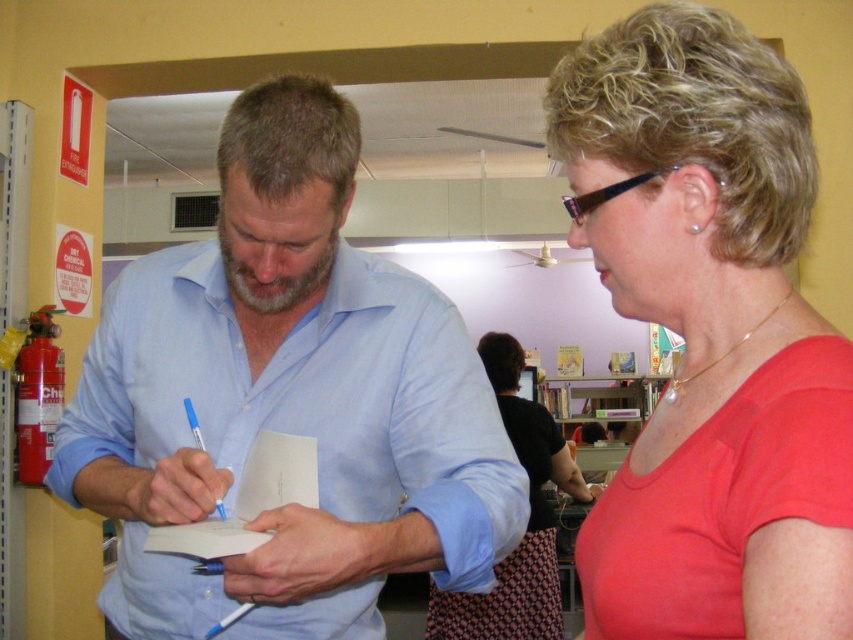
Question: Can you confirm if matte black shirt at center is thinner than wooden bookshelf at center?

Choices:
 (A) yes
 (B) no

Answer: (A)

Question: Considering the real-world distances, which object is farthest from the matte red shirt at center?

Choices:
 (A) matte black shirt at center
 (B) wooden bookshelf at center
 (C) blue shirt at center

Answer: (B)

Question: Can you confirm if matte red shirt at center is thinner than wooden bookshelf at center?

Choices:
 (A) no
 (B) yes

Answer: (B)

Question: Which is farther from the matte red shirt at center?

Choices:
 (A) blue shirt at center
 (B) wooden bookshelf at center
 (C) matte black shirt at center

Answer: (B)

Question: Can you confirm if matte red shirt at center is positioned below matte black shirt at center?

Choices:
 (A) yes
 (B) no

Answer: (B)

Question: Which point is closer to the camera taking this photo?

Choices:
 (A) [x=368, y=628]
 (B) [x=814, y=353]
 (C) [x=572, y=426]
 (D) [x=527, y=608]

Answer: (B)